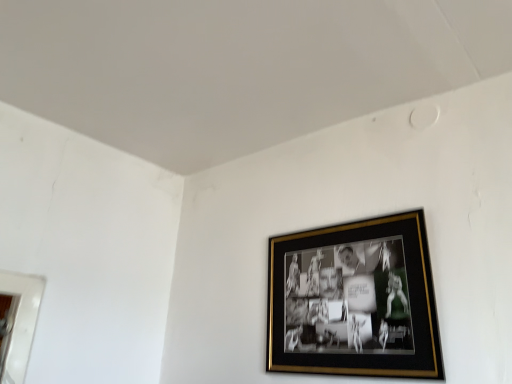
The width and height of the screenshot is (512, 384). In order to click on black/golden photo frame at lower center in this screenshot , I will do `click(354, 300)`.

What do you see at coordinates (354, 300) in the screenshot? The image size is (512, 384). I see `black/golden photo frame at lower center` at bounding box center [354, 300].

Where is `black/golden photo frame at lower center`? This screenshot has height=384, width=512. black/golden photo frame at lower center is located at coordinates (354, 300).